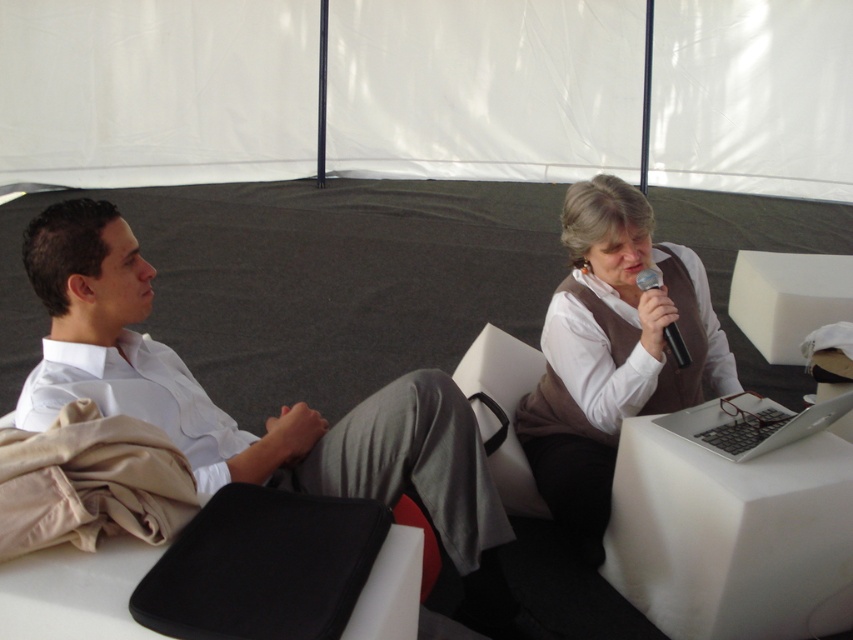
You are organizing a photoshoot and need to ensure that the white smooth shirt at left and the black plastic microphone at upper right are visible in the frame. Which object should you prioritize adjusting the camera angle for to ensure both are fully visible?

The white smooth shirt at left should be prioritized because its width is larger than the black plastic microphone at upper right, so it may require more space in the frame to be fully visible.

In the scene shown: You are a photographer standing at the camera position. You want to take a closeup photo of the silver metallic laptop at lower right. Can you reach it without moving your position?

The silver metallic laptop at lower right is 6.01 feet from camera, so yes, you can reach it without moving your position since it is within a reasonable distance for a photographer to capture a closeup.